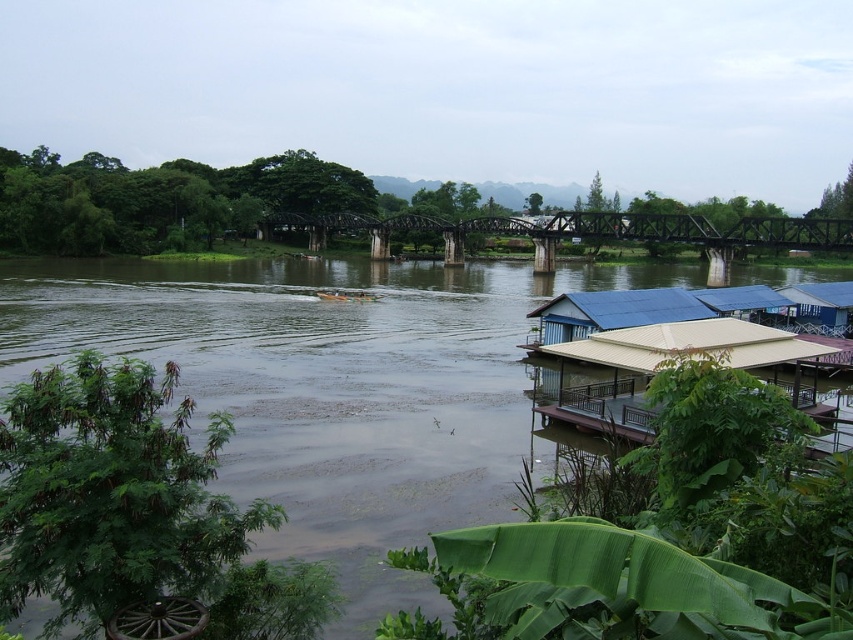
Can you confirm if greenish-brown water at center is bigger than green painted wood boat at center?

Yes, greenish-brown water at center is bigger than green painted wood boat at center.

Is greenish-brown water at center below green painted wood boat at center?

Actually, greenish-brown water at center is above green painted wood boat at center.

Which is behind, point (3, 260) or point (372, 294)?

Positioned behind is point (3, 260).

This screenshot has height=640, width=853. I want to click on greenish-brown water at center, so coord(329,388).

Where is `beige corrugated roof hut at lower right`? beige corrugated roof hut at lower right is located at coordinates (662, 365).

I want to click on beige corrugated roof hut at lower right, so click(x=662, y=365).

I want to click on beige corrugated roof hut at lower right, so click(662, 365).

Does point (279, 444) lie in front of point (683, 224)?

Yes, it is.

From the picture: Is greenish-brown water at center shorter than dark brown metal bridge at center?

Indeed, greenish-brown water at center has a lesser height compared to dark brown metal bridge at center.

Which is in front, point (142, 349) or point (764, 237)?

Point (142, 349)

The width and height of the screenshot is (853, 640). In order to click on greenish-brown water at center in this screenshot , I will do `click(329, 388)`.